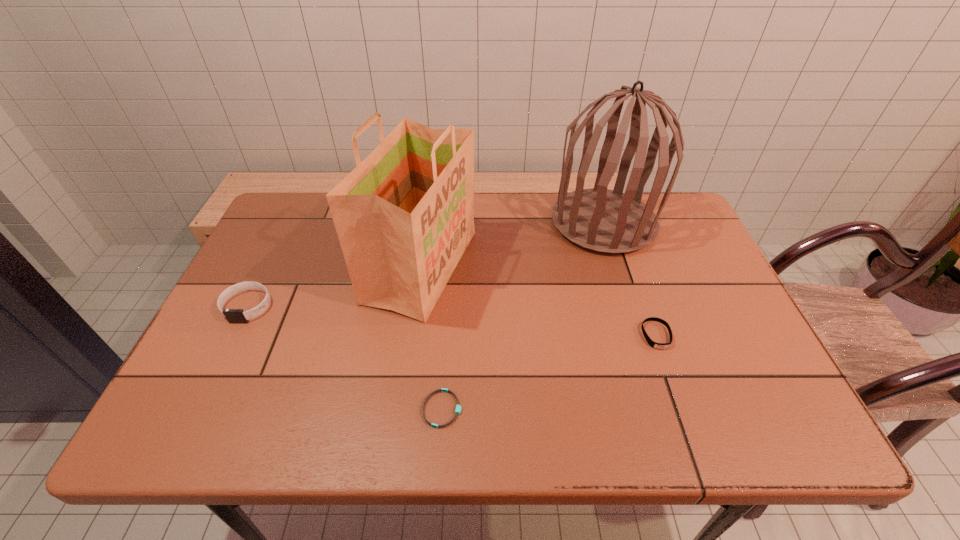
Image resolution: width=960 pixels, height=540 pixels. In order to click on vacant space located 0.290m on the outer surface of the tallest wristband in this screenshot , I will do [x=180, y=441].

I want to click on free space located 0.070m on the display of the second tallest wristband, so click(x=671, y=377).

Locate an element on the screen. The height and width of the screenshot is (540, 960). free space located on the buckle of the nearest object is located at coordinates (545, 409).

At what (x,y) coordinates should I click in order to perform the action: click on birdcage at the far edge. Please return your answer as a coordinate pair (x, y). This screenshot has height=540, width=960. Looking at the image, I should click on (608, 221).

The height and width of the screenshot is (540, 960). Identify the location of grocery bag at the far edge. click(404, 216).

Find the location of a particular element. This screenshot has width=960, height=540. object that is at the near edge is located at coordinates (458, 407).

At what (x,y) coordinates should I click in order to perform the action: click on object at the left edge. Please return your answer as a coordinate pair (x, y). The height and width of the screenshot is (540, 960). Looking at the image, I should click on (232, 315).

Image resolution: width=960 pixels, height=540 pixels. In order to click on object present at the right edge in this screenshot , I will do `click(608, 221)`.

Locate an element on the screen. object at the far right corner is located at coordinates (608, 221).

Locate an element on the screen. The width and height of the screenshot is (960, 540). vacant space at the far edge of the desktop is located at coordinates (491, 220).